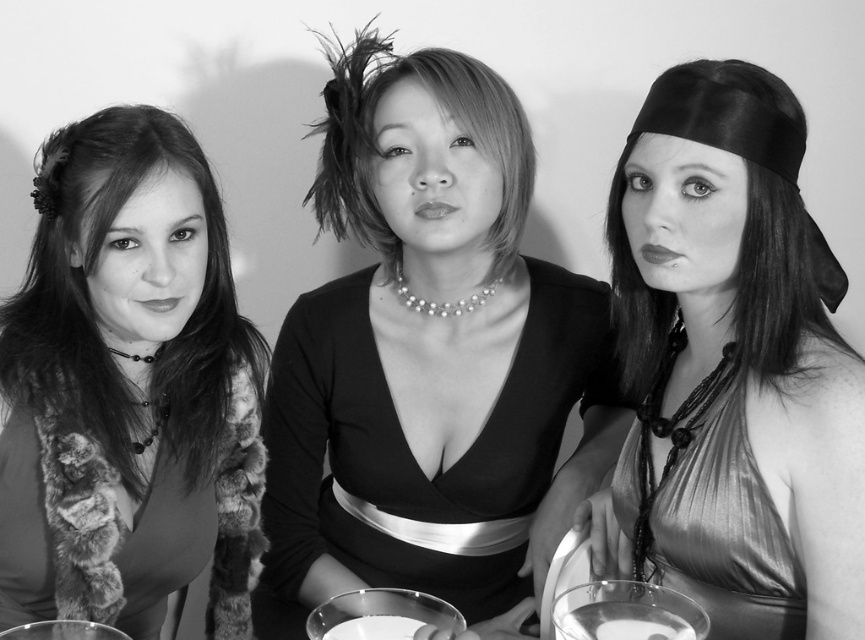
You are a photographer who needs to ensure that all items in the scene are visible in the final photo. Given that the fur scarf at left and the clear glass at center are two items of interest, which one might require more careful lighting to avoid overexposure?

The fur scarf at left requires more careful lighting since it is larger in size than the clear glass at center, making it more prone to overexposure if not properly lit.

You are a photographer setting up a photo shoot with three women. You need to place a clear glass between the fur scarf at left and the central woman. Can the clear glass at center fit in the space between them?

The distance between the fur scarf at left and clear glass at center is 15.39 inches, so yes, the clear glass at center can fit in the space between them as the distance is sufficient.

You are a photographer setting up a shoot in a room with a plain background. You notice a transparent glass at center located at point (x=380, y=614). To avoid reflections, where should you position your lights relative to this point?

The transparent glass at center is located at point (x=380, y=614). To avoid reflections, position the lights either to the left or right of this point, ensuring they are not directly in line with the camera.